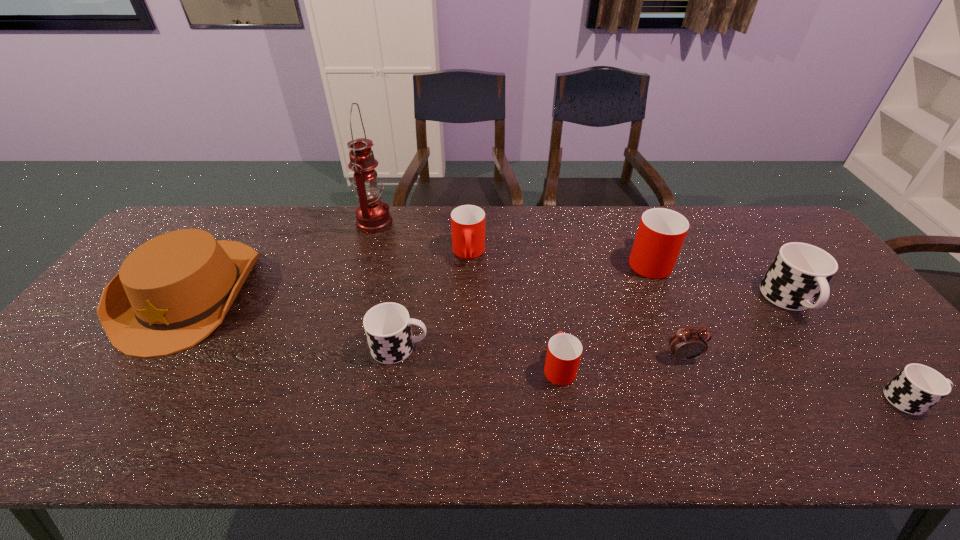
You are a GUI agent. You are given a task and a screenshot of the screen. Output one action in this format:
    pyautogui.click(x=<x>, y=<y>)
    Task: Click on the leftmost black cup
    
    Given the screenshot: What is the action you would take?
    pyautogui.click(x=387, y=325)

Where is `the seventh object from right to left`? This screenshot has height=540, width=960. the seventh object from right to left is located at coordinates 387,325.

The image size is (960, 540). Find the location of `the fifth object from left to right`. the fifth object from left to right is located at coordinates (564, 351).

Where is `the smallest red cup`? the smallest red cup is located at coordinates (564, 351).

Identify the location of the shortest cup. This screenshot has height=540, width=960. (916, 388).

At what (x,y) coordinates should I click in order to perform the action: click on the nearest black cup. Please return your answer as a coordinate pair (x, y). Looking at the image, I should click on (916, 388).

In order to click on free point located 0.170m on the left of the tallest object in this screenshot , I will do `click(306, 222)`.

Locate an element on the screen. vacant area situated 0.050m on the side of the biggest red cup with the handle is located at coordinates (636, 232).

I want to click on free space located on the side of the biggest red cup with the handle, so click(632, 221).

Find the location of `free spot located on the side of the biggest red cup with the handle`. free spot located on the side of the biggest red cup with the handle is located at coordinates pyautogui.click(x=636, y=230).